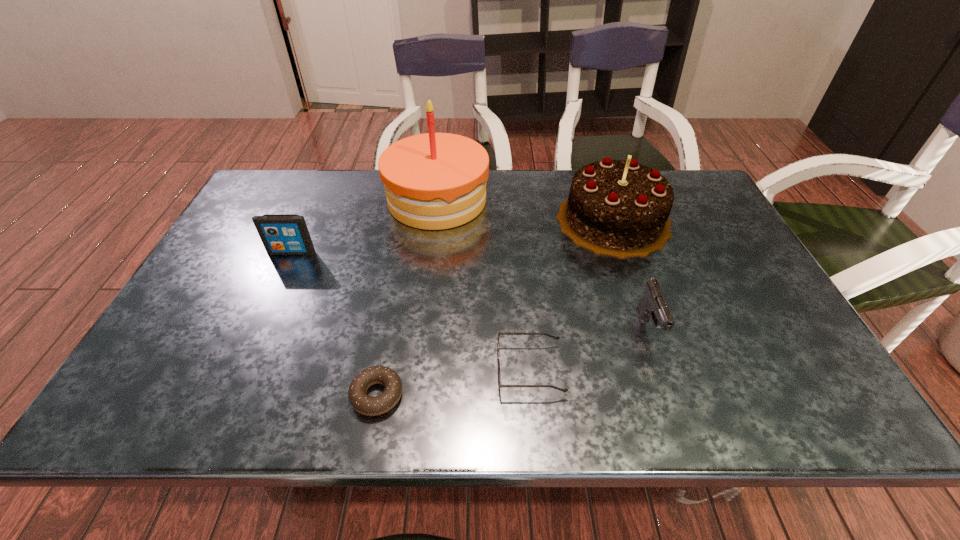
At what (x,y) coordinates should I click in order to perform the action: click on the taller birthday cake. Please return your answer as a coordinate pair (x, y). Looking at the image, I should click on (433, 181).

Where is `the left birthday cake`? the left birthday cake is located at coordinates (433, 181).

Locate an element on the screen. the shorter birthday cake is located at coordinates (619, 208).

In order to click on the second tallest object in this screenshot , I will do `click(619, 208)`.

Find the location of a particular element. The image size is (960, 540). iPod is located at coordinates (281, 234).

Locate an element on the screen. This screenshot has height=540, width=960. pistol is located at coordinates (653, 304).

This screenshot has height=540, width=960. Identify the location of the third object from right to left. (500, 385).

Locate an element on the screen. sunglasses is located at coordinates (500, 385).

Find the location of a particular element. Image resolution: width=960 pixels, height=540 pixels. doughnut is located at coordinates (371, 406).

At what (x,y) coordinates should I click in order to perform the action: click on free point located on the right of the taller birthday cake. Please return your answer as a coordinate pair (x, y). The image size is (960, 540). Looking at the image, I should click on (565, 200).